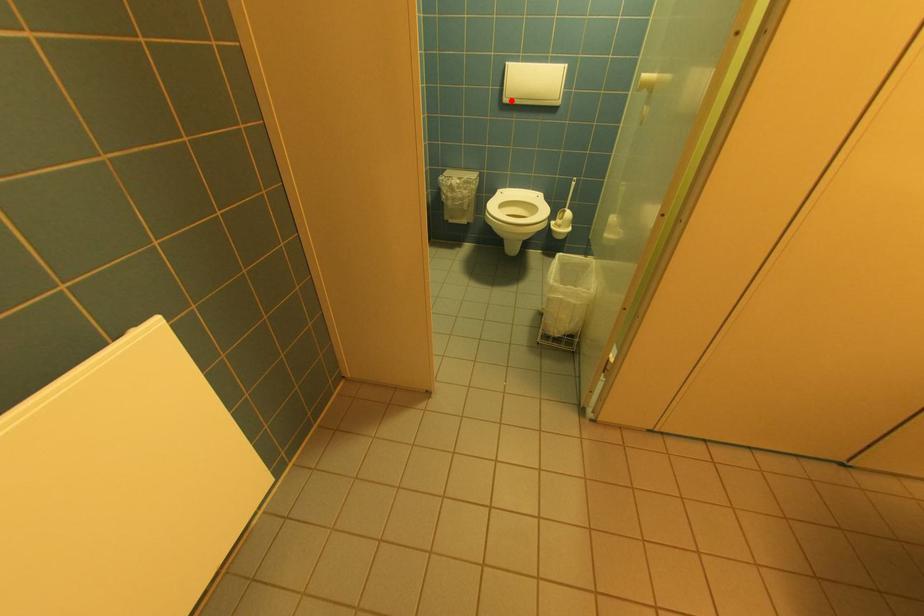
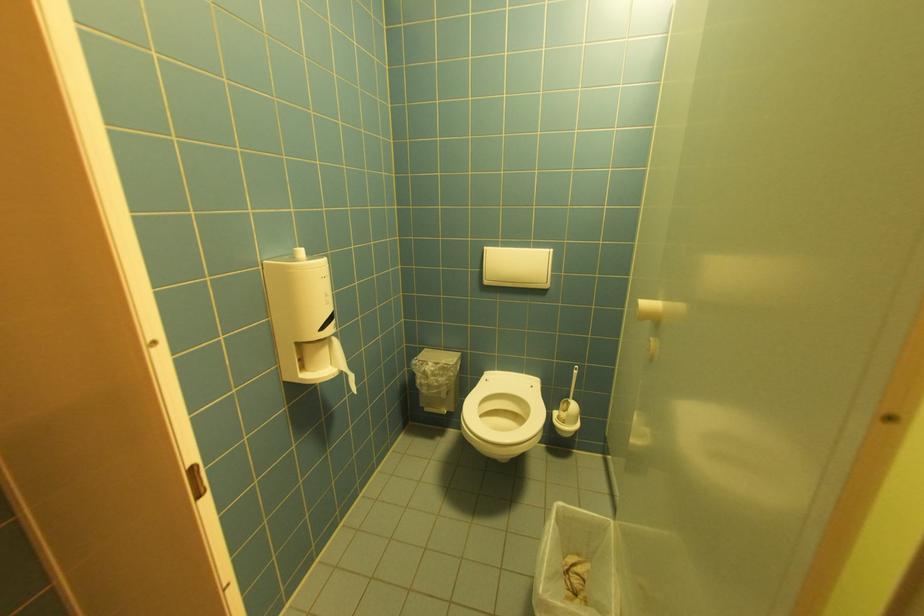
In the second image, find the point that corresponds to the highlighted location in the first image.

(492, 283)